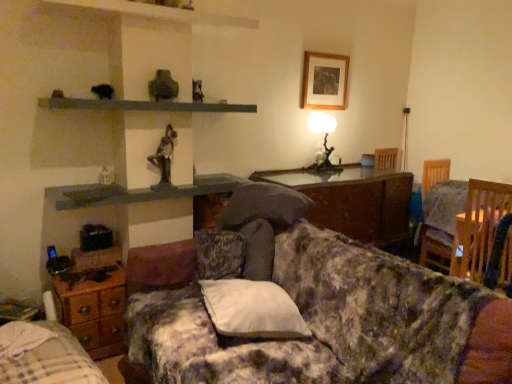
Find the location of `wooden chair at right, the second table in the bottom-to-top sequence`. wooden chair at right, the second table in the bottom-to-top sequence is located at coordinates (458, 246).

This screenshot has width=512, height=384. Describe the element at coordinates (324, 136) in the screenshot. I see `matte black table lamp at upper center` at that location.

Measure the distance between point (328,151) and camera.

The depth of point (328,151) is 11.79 feet.

Measure the distance between point (163, 139) and camera.

Point (163, 139) is 8.35 feet away from camera.

What is the approximate height of bronze statue at center?

bronze statue at center is 14.68 inches tall.

Find the location of a particular element. The width and height of the screenshot is (512, 384). wooden drawer at lower left, arranged as the 1th table when ordered from the bottom is located at coordinates (93, 308).

Visually, is brown wood cabinet at center positioned to the left or to the right of wooden chair at right, the second table in the bottom-to-top sequence?

brown wood cabinet at center is to the left of wooden chair at right, the second table in the bottom-to-top sequence.

From the image's perspective, who appears lower, brown wood cabinet at center or wooden chair at right, marked as the second table in a back-to-front arrangement?

wooden chair at right, marked as the second table in a back-to-front arrangement, is shown below in the image.

How far apart are brown wood cabinet at center and wooden chair at right, marked as the 2th table in a left-to-right arrangement?

A distance of 33.88 inches exists between brown wood cabinet at center and wooden chair at right, marked as the 2th table in a left-to-right arrangement.

Is the depth of brown wood cabinet at center less than that of wooden chair at right, which is counted as the first table, starting from the right?

That is False.

Is bronze statue at center positioned far away from wooden picture frame at upper center?

Yes, bronze statue at center and wooden picture frame at upper center are located far from each other.

From the image's perspective, which object appears higher, bronze statue at center or wooden picture frame at upper center?

wooden picture frame at upper center, from the image's perspective.

Which is behind, point (150, 187) or point (341, 58)?

Positioned behind is point (341, 58).

Is wooden drawer at lower left, arranged as the second table when viewed from the top, facing away from wooden chair at right, which is the 1th table in top-to-bottom order?

No, wooden drawer at lower left, arranged as the second table when viewed from the top, is not facing away from wooden chair at right, which is the 1th table in top-to-bottom order.

Which is less distant, (120,282) or (494,220)?

Clearly, point (120,282) is closer to the camera than point (494,220).

From a real-world perspective, who is located higher, wooden drawer at lower left, positioned as the 1th table in back-to-front order, or wooden chair at right, marked as the second table in a back-to-front arrangement?

wooden chair at right, marked as the second table in a back-to-front arrangement.

Is wooden drawer at lower left, the first table positioned from the left, placed right next to wooden chair at right, marked as the 2th table in a left-to-right arrangement?

wooden drawer at lower left, the first table positioned from the left, and wooden chair at right, marked as the 2th table in a left-to-right arrangement, are not in contact.

Which is more to the left, smooth gray shelf at upper center or wooden chair at right, the second table in the bottom-to-top sequence?

From the viewer's perspective, smooth gray shelf at upper center appears more on the left side.

Is smooth gray shelf at upper center far from wooden chair at right, which is the 1th table in top-to-bottom order?

Indeed, smooth gray shelf at upper center is not near wooden chair at right, which is the 1th table in top-to-bottom order.

From a real-world perspective, between smooth gray shelf at upper center and wooden chair at right, marked as the second table in a back-to-front arrangement, who is vertically lower?

wooden chair at right, marked as the second table in a back-to-front arrangement, is physically lower.

Considering the positions of points (325, 224) and (313, 370), is point (325, 224) closer to camera compared to point (313, 370)?

No, (325, 224) is behind (313, 370).

Is floral fabric couch at center located within brown wood cabinet at center?

No, floral fabric couch at center is located outside of brown wood cabinet at center.

From a real-world perspective, does brown wood cabinet at center stand above floral fabric couch at center?

Yes, from a real-world perspective, brown wood cabinet at center is above floral fabric couch at center.

Is brown wood cabinet at center further to the viewer compared to floral fabric couch at center?

Yes, brown wood cabinet at center is further from the viewer.

In order to click on pillow on the left side of wooden picture frame at upper center in this screenshot , I will do `click(252, 310)`.

Is white soft pillow at center facing towards wooden picture frame at upper center?

No, white soft pillow at center is not facing towards wooden picture frame at upper center.

From a real-world perspective, who is located lower, white soft pillow at center or wooden picture frame at upper center?

In real-world perspective, white soft pillow at center is lower.

Is white soft pillow at center facing towards wooden chair at right?

No.

Does point (281, 320) come closer to viewer compared to point (441, 219)?

That is True.

Which table is the 2nd one when counting from the front of the brown wood cabinet at center? Please provide its 2D coordinates.

[(458, 246)]

Find the location of a particular element. picture frame above the bronze statue at center (from the image's perspective) is located at coordinates (324, 81).

Looking at the image, which one is located further to wooden chair at right, the first table positioned from the front, smooth gray shelf at upper center or matte black table lamp at upper center?

smooth gray shelf at upper center is positioned further to the anchor wooden chair at right, the first table positioned from the front.

From the image, which object appears to be farther from floral fabric couch at center, wooden chair at right, the second table in the bottom-to-top sequence, or brown wood cabinet at center?

The object further to floral fabric couch at center is wooden chair at right, the second table in the bottom-to-top sequence.

When comparing their distances from wooden drawer at lower left, which is the second table in front-to-back order, does bronze statue at center or floral fabric couch at center seem further?

bronze statue at center.

Based on their spatial positions, is smooth gray shelf at upper center or wooden drawer at lower left, which is the second table in front-to-back order, closer to matte black table lamp at upper center?

Among the two, smooth gray shelf at upper center is located nearer to matte black table lamp at upper center.

Considering their positions, is floral fabric couch at center positioned closer to matte black table lamp at upper center than brown wood cabinet at center?

Among the two, brown wood cabinet at center is located nearer to matte black table lamp at upper center.

Which object lies further to the anchor point brown wood cabinet at center, wooden drawer at lower left, arranged as the second table when viewed from the top, or smooth gray shelf at upper center?

wooden drawer at lower left, arranged as the second table when viewed from the top, is positioned further to the anchor brown wood cabinet at center.

Based on their spatial positions, is brown wood cabinet at center or matte black table lamp at upper center closer to wooden drawer at lower left, which is the second table in front-to-back order?

brown wood cabinet at center lies closer to wooden drawer at lower left, which is the second table in front-to-back order, than the other object.

When comparing their distances from brown wood cabinet at center, does bronze statue at center or matte black table lamp at upper center seem further?

bronze statue at center.

Find the location of `person between smooth gray shelf at upper center and white soft pillow at center in the vertical direction`. person between smooth gray shelf at upper center and white soft pillow at center in the vertical direction is located at coordinates (164, 158).

In order to click on table located between wooden drawer at lower left, arranged as the second table when viewed from the top, and wooden chair at right in the left-right direction in this screenshot , I will do `click(458, 246)`.

This screenshot has height=384, width=512. Find the location of `cabinetry situated between wooden bed frame at lower left and wooden chair at right from left to right`. cabinetry situated between wooden bed frame at lower left and wooden chair at right from left to right is located at coordinates point(353,200).

Where is `person located between wooden drawer at lower left, arranged as the second table when viewed from the top, and brown wood cabinet at center in the left-right direction`? The width and height of the screenshot is (512, 384). person located between wooden drawer at lower left, arranged as the second table when viewed from the top, and brown wood cabinet at center in the left-right direction is located at coordinates (164, 158).